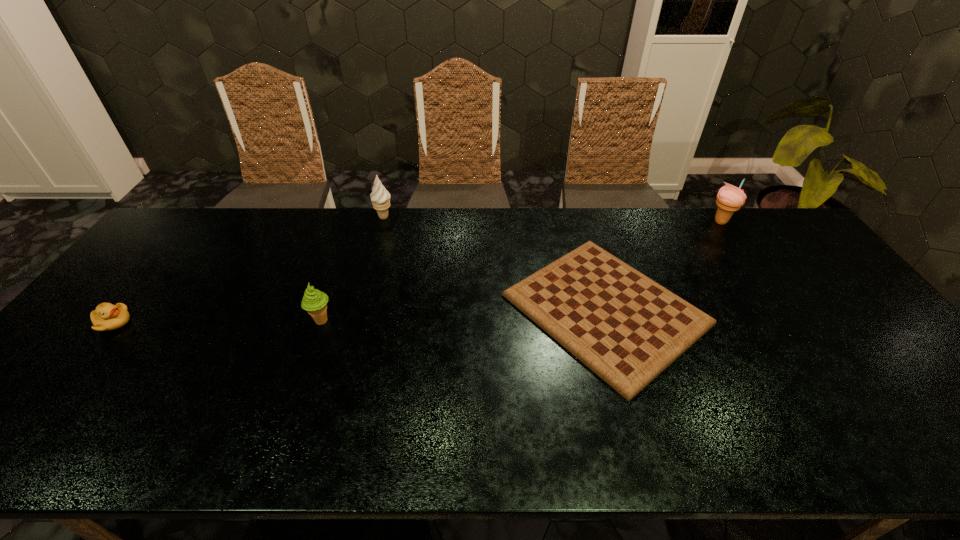
Where is `free area in between the nearest icecream and the third object from right to left`? This screenshot has height=540, width=960. free area in between the nearest icecream and the third object from right to left is located at coordinates (352, 269).

Where is `vacant space that's between the leftmost icecream and the gameboard`? The height and width of the screenshot is (540, 960). vacant space that's between the leftmost icecream and the gameboard is located at coordinates (464, 315).

I want to click on vacant space that is in between the rightmost object and the duckling, so click(417, 272).

This screenshot has width=960, height=540. Find the location of `vacant space in between the second shortest object and the gameboard`. vacant space in between the second shortest object and the gameboard is located at coordinates (359, 316).

The image size is (960, 540). I want to click on vacant region between the rightmost object and the fourth object from left to right, so click(x=663, y=266).

Where is `free space between the rightmost icecream and the second object from left to right`? free space between the rightmost icecream and the second object from left to right is located at coordinates (521, 271).

Find the location of a particular element. The image size is (960, 540). unoccupied area between the duckling and the rightmost icecream is located at coordinates click(x=417, y=272).

The width and height of the screenshot is (960, 540). In order to click on free area in between the leftmost icecream and the fourth object from left to right in this screenshot , I will do `click(464, 315)`.

You are a GUI agent. You are given a task and a screenshot of the screen. Output one action in this format:
    pyautogui.click(x=<x>, y=<y>)
    Task: Click on the free space between the gameboard and the leftmost icecream
    Image resolution: width=960 pixels, height=540 pixels.
    Given the screenshot: What is the action you would take?
    click(464, 315)

Where is `object that is the third closest to the second object from left to right`? The height and width of the screenshot is (540, 960). object that is the third closest to the second object from left to right is located at coordinates (106, 317).